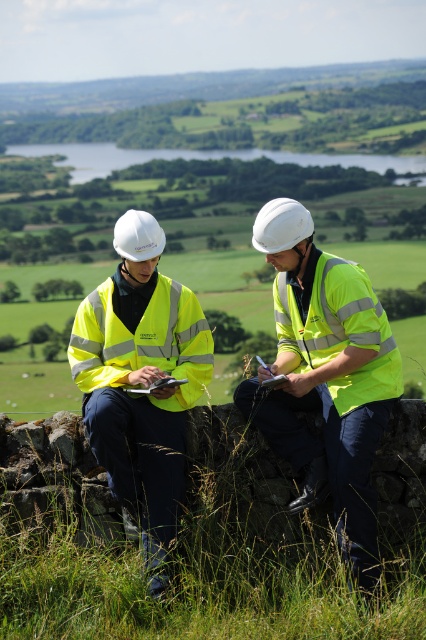
Does yellow reflective vest at center appear under high-visibility yellow vest at center?

Incorrect, yellow reflective vest at center is not positioned below high-visibility yellow vest at center.

Between point (328, 401) and point (379, 413), which one is positioned behind?

The point (328, 401) is behind.

Locate an element on the screen. yellow reflective vest at center is located at coordinates (325, 376).

Does high-visibility fabric safety vest at right have a smaller size compared to high-visibility fabric safety vest at center?

Yes, high-visibility fabric safety vest at right is smaller than high-visibility fabric safety vest at center.

Is point (359, 292) positioned behind point (75, 362)?

No.

Where is `high-visibility fabric safety vest at right`? The image size is (426, 640). high-visibility fabric safety vest at right is located at coordinates (337, 328).

Which is behind, point (173, 490) or point (299, 340)?

Positioned behind is point (299, 340).

The image size is (426, 640). I want to click on yellow reflective vest at left, so (141, 378).

Identify the location of yellow reflective vest at left. Image resolution: width=426 pixels, height=640 pixels. (141, 378).